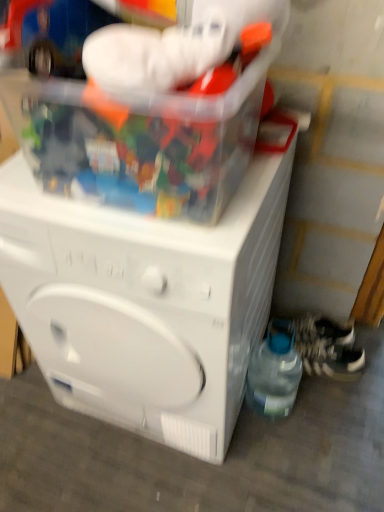
Question: Is translucent plastic container at upper center to the left of transparent plastic bottle at lower right from the viewer's perspective?

Choices:
 (A) no
 (B) yes

Answer: (B)

Question: Is translucent plastic container at upper center further to the viewer compared to transparent plastic bottle at lower right?

Choices:
 (A) no
 (B) yes

Answer: (A)

Question: Is translucent plastic container at upper center facing away from transparent plastic bottle at lower right?

Choices:
 (A) no
 (B) yes

Answer: (A)

Question: Is translucent plastic container at upper center wider than transparent plastic bottle at lower right?

Choices:
 (A) yes
 (B) no

Answer: (A)

Question: Is translucent plastic container at upper center closer to the viewer compared to transparent plastic bottle at lower right?

Choices:
 (A) yes
 (B) no

Answer: (A)

Question: Does translucent plastic container at upper center have a greater height compared to transparent plastic bottle at lower right?

Choices:
 (A) no
 (B) yes

Answer: (A)

Question: From a real-world perspective, is translucent plastic container at upper center beneath white textured shoe at lower right, which ranks as the 1th shoe in top-to-bottom order?

Choices:
 (A) no
 (B) yes

Answer: (A)

Question: Can you confirm if translucent plastic container at upper center is positioned to the right of white textured shoe at lower right, marked as the 2th shoe in a bottom-to-top arrangement?

Choices:
 (A) no
 (B) yes

Answer: (A)

Question: Considering the relative positions of translucent plastic container at upper center and white textured shoe at lower right, which ranks as the 1th shoe in top-to-bottom order, in the image provided, is translucent plastic container at upper center to the left of white textured shoe at lower right, which ranks as the 1th shoe in top-to-bottom order, from the viewer's perspective?

Choices:
 (A) yes
 (B) no

Answer: (A)

Question: Is white textured shoe at lower right, which ranks as the 1th shoe in top-to-bottom order, surrounded by translucent plastic container at upper center?

Choices:
 (A) yes
 (B) no

Answer: (B)

Question: Is white textured shoe at lower right, marked as the 2th shoe in a bottom-to-top arrangement, at the back of translucent plastic container at upper center?

Choices:
 (A) yes
 (B) no

Answer: (B)

Question: From the image's perspective, is translucent plastic container at upper center above white textured shoe at lower right, which ranks as the 1th shoe in top-to-bottom order?

Choices:
 (A) no
 (B) yes

Answer: (B)

Question: Does white textured shoe at lower right, which appears as the second shoe when viewed from the top, have a lesser height compared to white textured shoe at lower right, which ranks as the 1th shoe in top-to-bottom order?

Choices:
 (A) yes
 (B) no

Answer: (B)